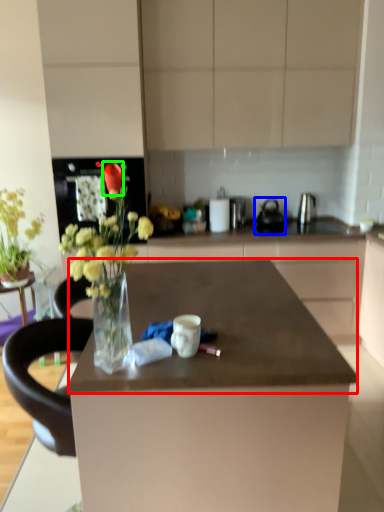
Question: Which object is the farthest from countertop (highlighted by a red box)? Choose among these: appliance (highlighted by a blue box) or flower (highlighted by a green box).

Choices:
 (A) appliance
 (B) flower

Answer: (A)